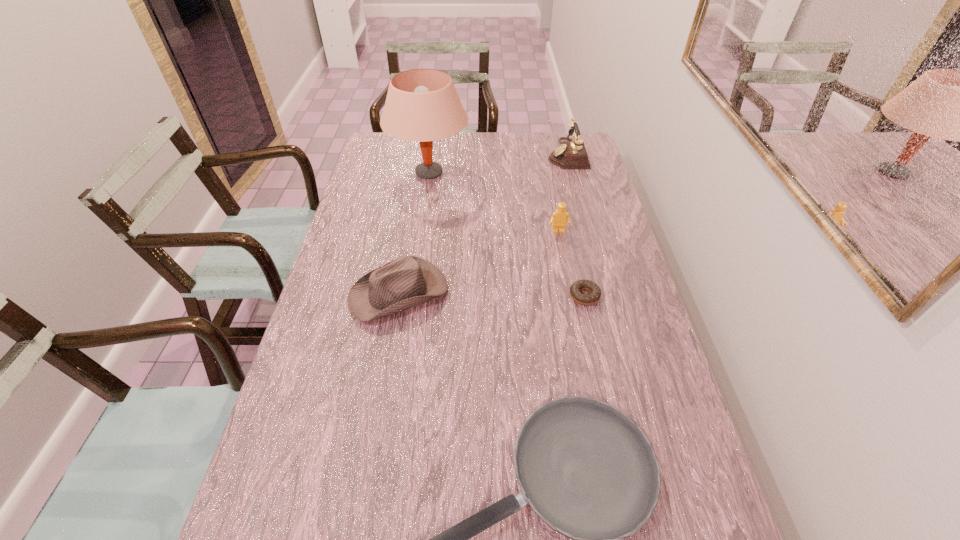
Locate an element on the screen. This screenshot has height=540, width=960. vacant space located on the right of the fedora is located at coordinates (536, 293).

The width and height of the screenshot is (960, 540). I want to click on vacant space situated on the back of the doughnut, so click(x=564, y=204).

The width and height of the screenshot is (960, 540). Identify the location of lampshade that is at the far edge. (422, 105).

I want to click on telephone at the far edge, so [571, 154].

Locate an element on the screen. The image size is (960, 540). lampshade that is at the left edge is located at coordinates (422, 105).

You are a GUI agent. You are given a task and a screenshot of the screen. Output one action in this format:
    pyautogui.click(x=<x>, y=<y>)
    Task: Click on the fedora that is at the left edge
    Image resolution: width=960 pixels, height=540 pixels.
    Given the screenshot: What is the action you would take?
    pyautogui.click(x=408, y=281)

Find the location of `telephone that is at the right edge`. telephone that is at the right edge is located at coordinates (571, 154).

At what (x,y) coordinates should I click in order to perform the action: click on Lego present at the right edge. Please return your answer as a coordinate pair (x, y). This screenshot has width=960, height=540. Looking at the image, I should click on pyautogui.click(x=559, y=218).

The height and width of the screenshot is (540, 960). Find the location of `doughnut that is at the right edge`. doughnut that is at the right edge is located at coordinates (595, 293).

Where is `object that is at the far left corner`? object that is at the far left corner is located at coordinates (422, 105).